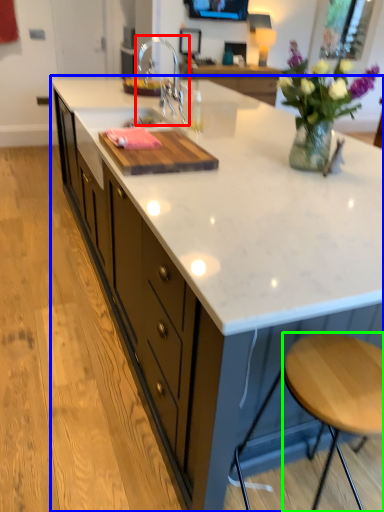
Question: Which object is positioned closest to tap (highlighted by a red box)? Select from countertop (highlighted by a blue box) and stool (highlighted by a green box).

Choices:
 (A) countertop
 (B) stool

Answer: (A)